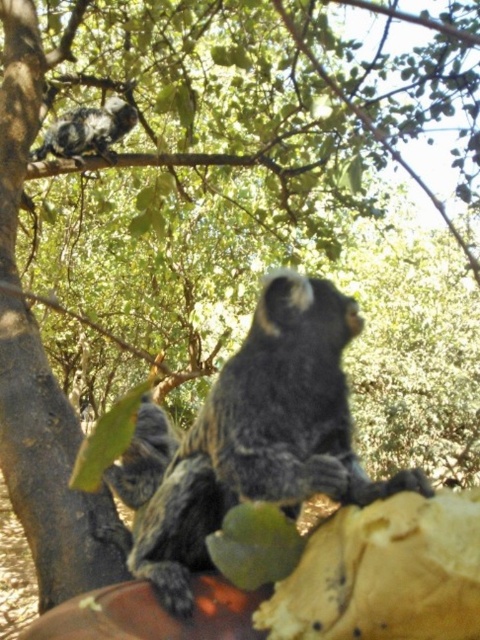
Which is in front, point (236, 579) or point (111, 465)?

Point (236, 579) is in front.

Is green matte leaf at lower center positioned at the back of dark gray fur monkey at center?

No, it is in front of dark gray fur monkey at center.

Is point (275, 557) positioned behind point (165, 458)?

No, it is not.

Identify the location of green matte leaf at lower center. click(254, 545).

Does soft gray fur monkey at center have a greater height compared to white fur monkey at upper left?

Incorrect, soft gray fur monkey at center's height is not larger of white fur monkey at upper left's.

Is point (336, 362) positioned in front of point (130, 128)?

Yes.

I want to click on soft gray fur monkey at center, so click(263, 435).

Where is `soft gray fur monkey at center`? The height and width of the screenshot is (640, 480). soft gray fur monkey at center is located at coordinates (263, 435).

Between green matte leaf at lower center and white fur monkey at upper left, which one appears on the right side from the viewer's perspective?

green matte leaf at lower center

Consider the image. Does green matte leaf at lower center come in front of white fur monkey at upper left?

Yes, it is.

This screenshot has width=480, height=640. Find the location of `green matte leaf at lower center`. green matte leaf at lower center is located at coordinates (254, 545).

This screenshot has width=480, height=640. I want to click on green matte leaf at lower center, so click(x=254, y=545).